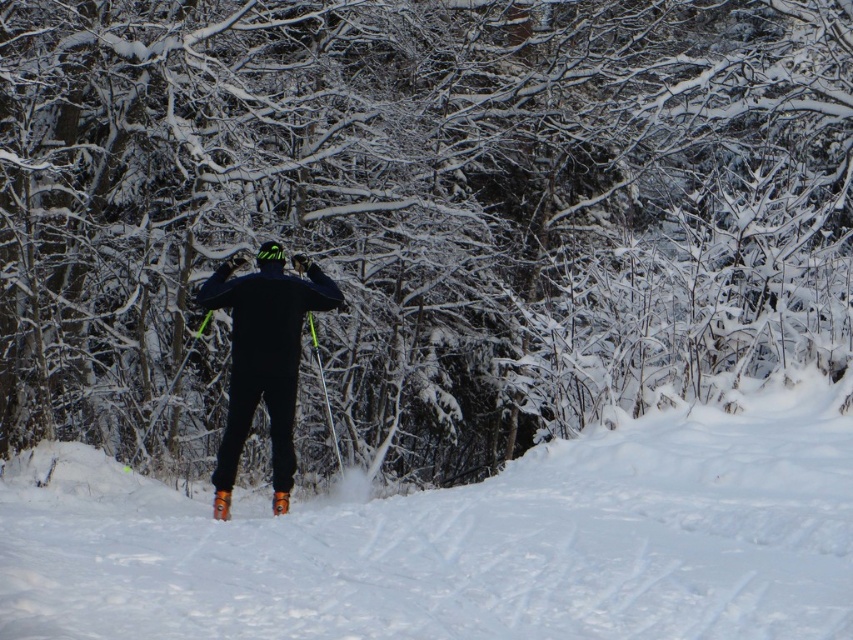
Question: Is matte black snowboarder at center further to the viewer compared to orange plastic ski at lower center?

Choices:
 (A) yes
 (B) no

Answer: (A)

Question: Is the position of white fluffy snow at center more distant than that of orange plastic ski at lower center?

Choices:
 (A) yes
 (B) no

Answer: (B)

Question: Is the position of white fluffy snow at center less distant than that of matte black snowboarder at center?

Choices:
 (A) no
 (B) yes

Answer: (B)

Question: Which point is farther from the camera taking this photo?

Choices:
 (A) (219, 513)
 (B) (280, 348)
 (C) (553, 538)

Answer: (B)

Question: Which point is farther from the camera taking this photo?

Choices:
 (A) (227, 509)
 (B) (416, 582)
 (C) (296, 332)

Answer: (C)

Question: Which object is closer to the camera taking this photo?

Choices:
 (A) matte black snowboarder at center
 (B) white fluffy snow at center
 (C) orange plastic ski at lower center

Answer: (B)